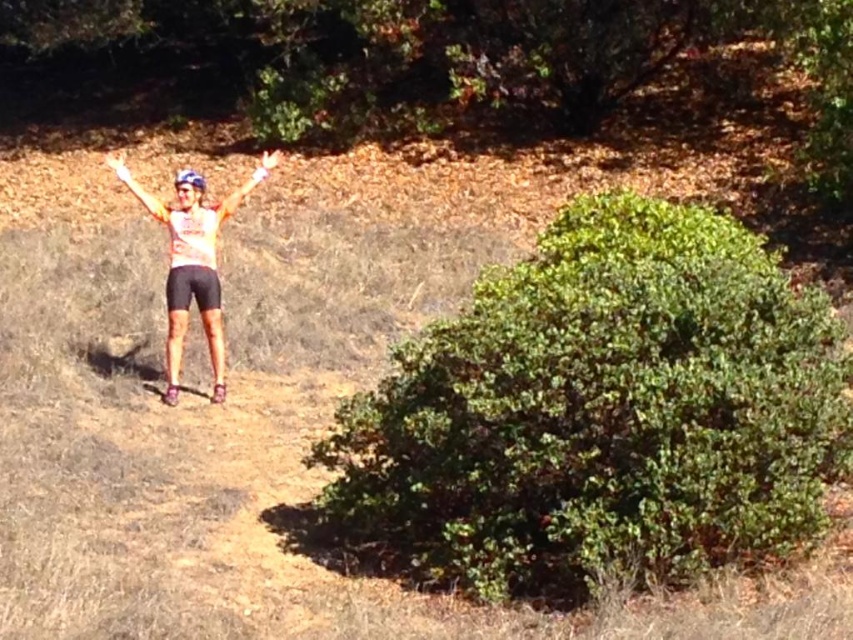
Question: Does orange matte tank top at center appear on the left side of matte orange glove at center?

Choices:
 (A) no
 (B) yes

Answer: (A)

Question: Which object is farther from the camera taking this photo?

Choices:
 (A) green leafy bush at lower right
 (B) matte orange arm at center
 (C) matte orange glove at center

Answer: (B)

Question: Which object is the farthest from the green leafy bush at lower right?

Choices:
 (A) matte orange arm at center
 (B) matte orange glove at center

Answer: (B)

Question: Can you confirm if orange matte tank top at center is bigger than matte orange arm at center?

Choices:
 (A) yes
 (B) no

Answer: (B)

Question: Which point is closer to the camera?

Choices:
 (A) (837, 401)
 (B) (123, 154)
 (C) (210, 244)
 (D) (280, 156)

Answer: (A)

Question: Where is green leafy bush at lower right located in relation to orange matte tank top at center in the image?

Choices:
 (A) below
 (B) above

Answer: (A)